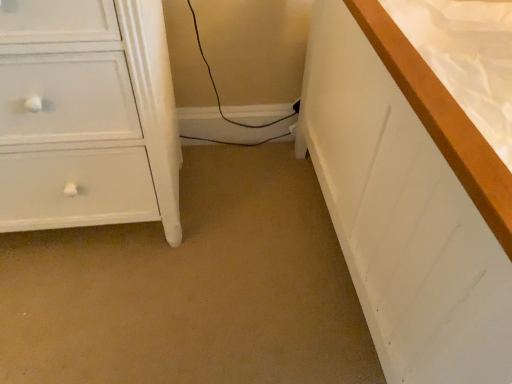
Question: Does white wood bed at right have a lesser height compared to white painted wood chest of drawers at left?

Choices:
 (A) yes
 (B) no

Answer: (B)

Question: Is white wood bed at right far away from white painted wood chest of drawers at left?

Choices:
 (A) yes
 (B) no

Answer: (B)

Question: Is white wood bed at right closer to camera compared to white painted wood chest of drawers at left?

Choices:
 (A) yes
 (B) no

Answer: (A)

Question: From the image's perspective, does white wood bed at right appear lower than white painted wood chest of drawers at left?

Choices:
 (A) no
 (B) yes

Answer: (B)

Question: Is white wood bed at right further to the viewer compared to white painted wood chest of drawers at left?

Choices:
 (A) no
 (B) yes

Answer: (A)

Question: Considering the relative positions of white wood bed at right and white painted wood chest of drawers at left in the image provided, is white wood bed at right to the left of white painted wood chest of drawers at left from the viewer's perspective?

Choices:
 (A) no
 (B) yes

Answer: (A)

Question: Can you confirm if white painted wood chest of drawers at left is bigger than white wood bed at right?

Choices:
 (A) yes
 (B) no

Answer: (B)

Question: Is white painted wood chest of drawers at left shorter than white wood bed at right?

Choices:
 (A) no
 (B) yes

Answer: (B)

Question: From a real-world perspective, is white painted wood chest of drawers at left located beneath white wood bed at right?

Choices:
 (A) no
 (B) yes

Answer: (B)

Question: Is white painted wood chest of drawers at left to the left of white wood bed at right from the viewer's perspective?

Choices:
 (A) no
 (B) yes

Answer: (B)

Question: Is white painted wood chest of drawers at left turned away from white wood bed at right?

Choices:
 (A) no
 (B) yes

Answer: (A)

Question: Does white painted wood chest of drawers at left contain white wood bed at right?

Choices:
 (A) yes
 (B) no

Answer: (B)

Question: Is point (376, 115) closer or farther from the camera than point (78, 221)?

Choices:
 (A) farther
 (B) closer

Answer: (B)